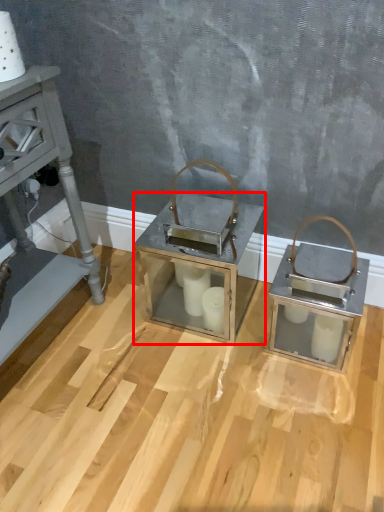
Question: From the image's perspective, where is table (annotated by the red box) located relative to furniture?

Choices:
 (A) above
 (B) below

Answer: (A)